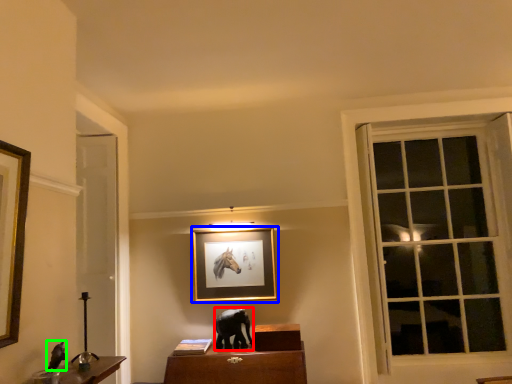
Question: Considering the real-world distances, which object is farthest from animal (highlighted by a red box)? picture frame (highlighted by a blue box) or animal (highlighted by a green box)?

Choices:
 (A) picture frame
 (B) animal

Answer: (B)